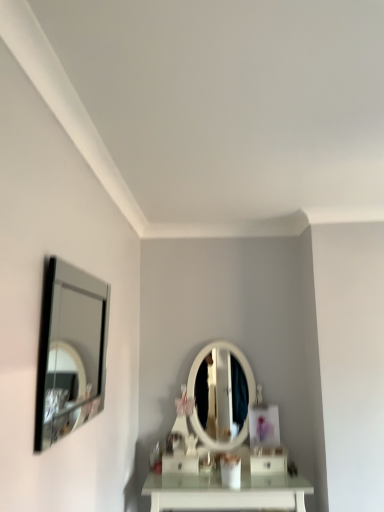
Question: From the image's perspective, does white glossy drawer at lower center, which ranks as the second drawer in left-to-right order, appear higher than silver-framed mirror at left?

Choices:
 (A) no
 (B) yes

Answer: (A)

Question: Are white glossy drawer at lower center, which ranks as the second drawer in left-to-right order, and silver-framed mirror at left making contact?

Choices:
 (A) yes
 (B) no

Answer: (B)

Question: From the image's perspective, is white glossy drawer at lower center, acting as the 1th drawer starting from the right, below silver-framed mirror at left?

Choices:
 (A) yes
 (B) no

Answer: (A)

Question: Is white glossy drawer at lower center, which ranks as the second drawer in left-to-right order, oriented towards silver-framed mirror at left?

Choices:
 (A) no
 (B) yes

Answer: (A)

Question: Is white glossy drawer at lower center, which ranks as the second drawer in left-to-right order, thinner than silver-framed mirror at left?

Choices:
 (A) no
 (B) yes

Answer: (A)

Question: Is white glossy drawer at lower center, which ranks as the second drawer in left-to-right order, positioned behind silver-framed mirror at left?

Choices:
 (A) yes
 (B) no

Answer: (A)

Question: From the image's perspective, does white glossy drawer at lower center, which ranks as the second drawer in left-to-right order, appear lower than white glossy drawer at center, arranged as the first drawer when viewed from the left?

Choices:
 (A) no
 (B) yes

Answer: (A)

Question: Is white glossy drawer at lower center, which ranks as the second drawer in left-to-right order, surrounding white glossy drawer at center, arranged as the first drawer when viewed from the left?

Choices:
 (A) yes
 (B) no

Answer: (B)

Question: From the image's perspective, is white glossy drawer at lower center, acting as the 1th drawer starting from the right, located above white glossy drawer at center, arranged as the 2th drawer when viewed from the right?

Choices:
 (A) no
 (B) yes

Answer: (B)

Question: From a real-world perspective, is white glossy drawer at lower center, acting as the 1th drawer starting from the right, located higher than white glossy drawer at center, arranged as the 2th drawer when viewed from the right?

Choices:
 (A) yes
 (B) no

Answer: (B)

Question: Considering the relative sizes of white glossy drawer at lower center, which ranks as the second drawer in left-to-right order, and white glossy drawer at center, arranged as the first drawer when viewed from the left, in the image provided, is white glossy drawer at lower center, which ranks as the second drawer in left-to-right order, smaller than white glossy drawer at center, arranged as the first drawer when viewed from the left,?

Choices:
 (A) yes
 (B) no

Answer: (A)

Question: Is white glossy drawer at lower center, which ranks as the second drawer in left-to-right order, at the left side of white glossy drawer at center, arranged as the first drawer when viewed from the left?

Choices:
 (A) no
 (B) yes

Answer: (A)

Question: Could white glossy drawer at lower center, acting as the 1th drawer starting from the right, be considered to be inside white glossy drawer at center, arranged as the first drawer when viewed from the left?

Choices:
 (A) no
 (B) yes

Answer: (A)